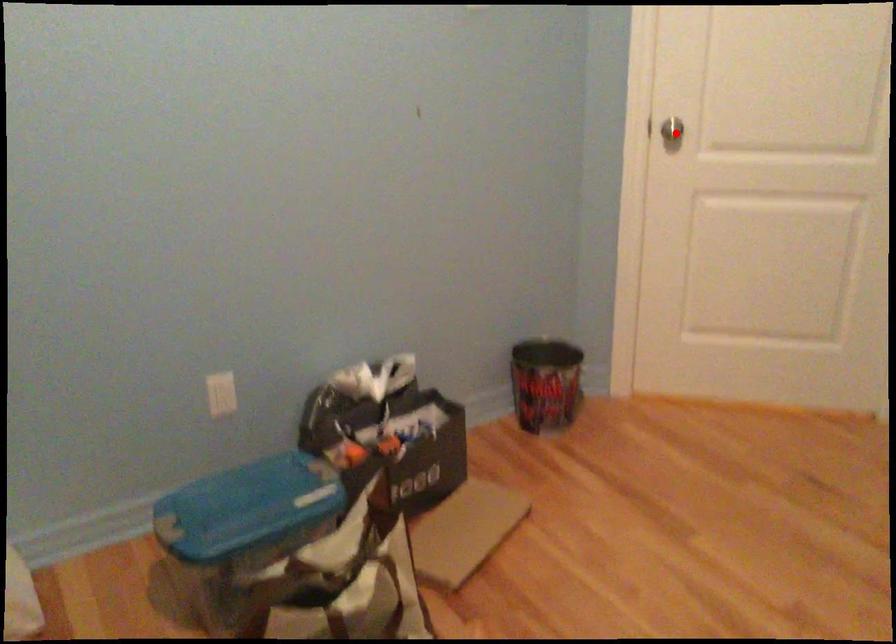
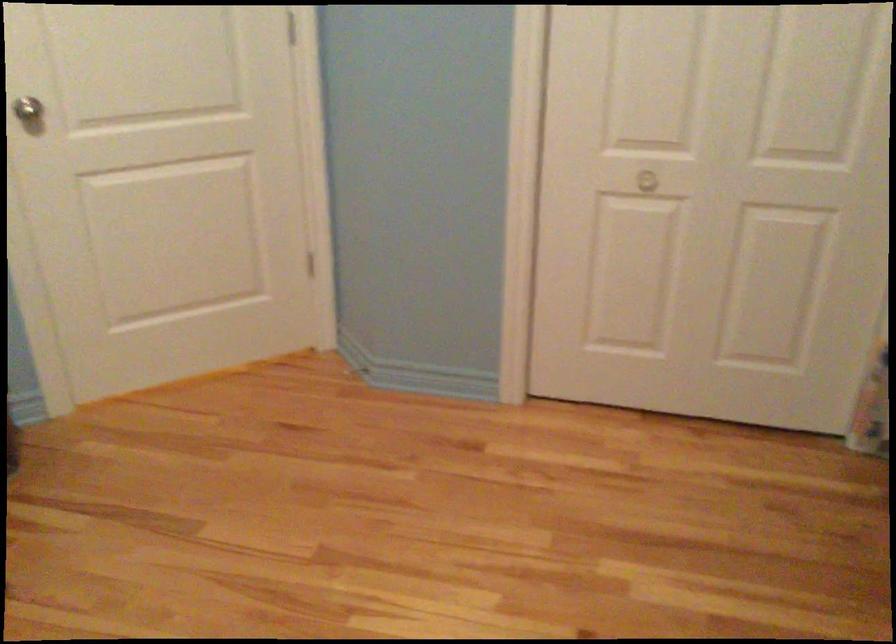
Question: I am providing you with two images of the same scene from different viewpoints. In image1, a red point is highlighted. Considering the same 3D point in image2, which of the following is correct?

Choices:
 (A) It is closer
 (B) It is farther

Answer: (A)